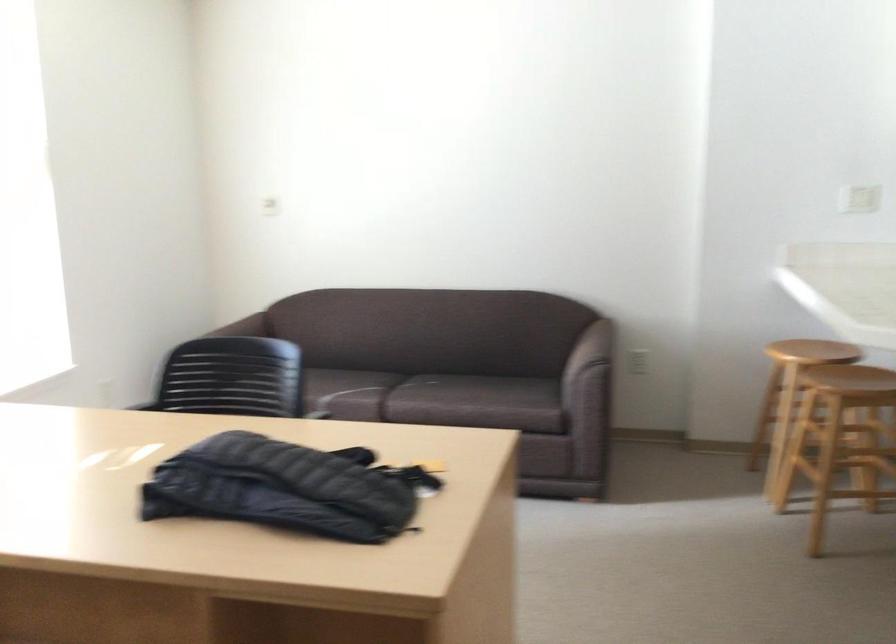
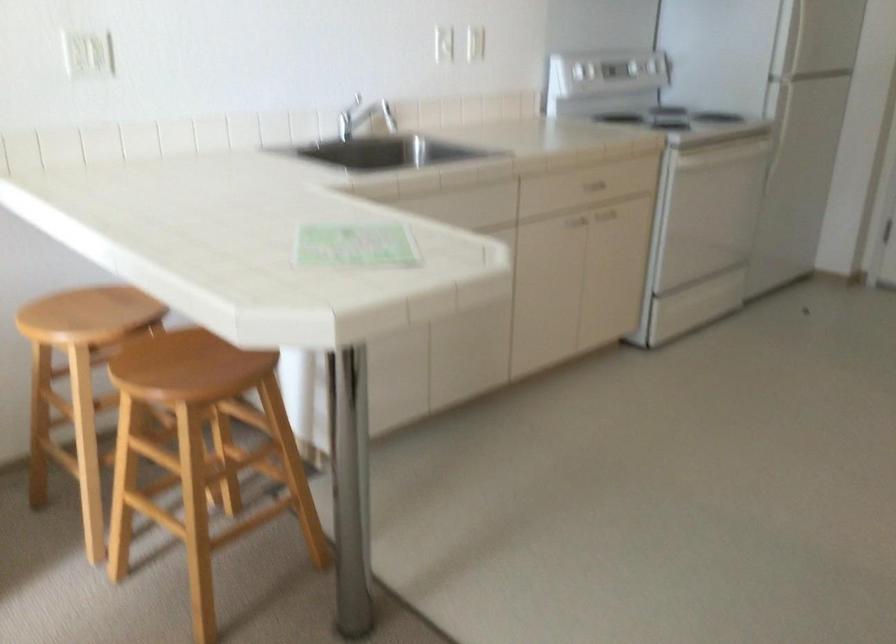
In the second image, find the point that corresponds to pixel 814 341 in the first image.

(82, 315)